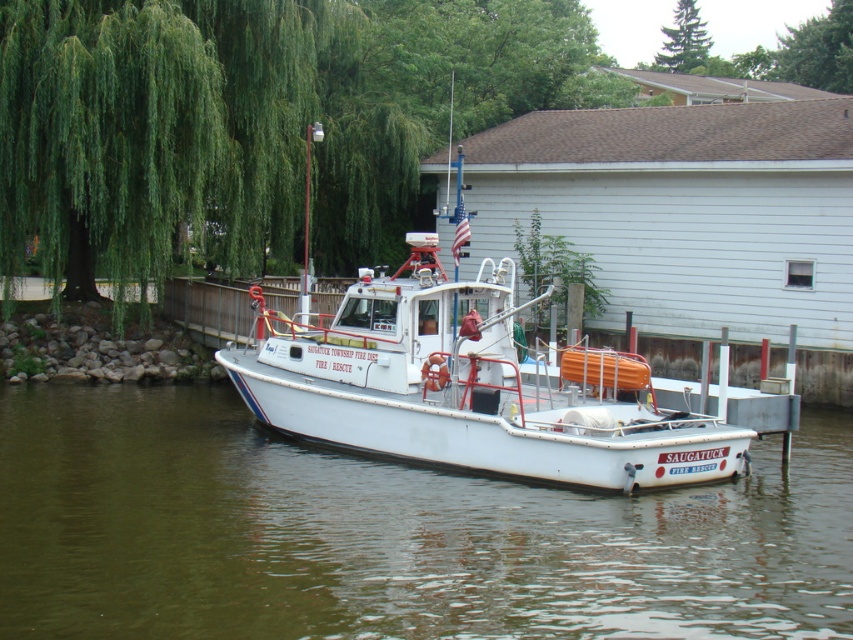
Does white matte boat at center appear on the right side of green leafy tree at upper center?

In fact, white matte boat at center is to the left of green leafy tree at upper center.

Who is more distant from viewer, (488, 282) or (688, 26)?

The point (688, 26) is behind.

Image resolution: width=853 pixels, height=640 pixels. Describe the element at coordinates (467, 387) in the screenshot. I see `white matte boat at center` at that location.

Find the location of a particular element. white matte boat at center is located at coordinates (467, 387).

Which is below, white smooth water at center or green leafy tree at upper center?

white smooth water at center is below.

Which is above, white smooth water at center or green leafy tree at upper center?

Positioned higher is green leafy tree at upper center.

Identify the location of white smooth water at center. This screenshot has width=853, height=640. (387, 534).

Is white smooth water at center wider than white matte boat at center?

Indeed, white smooth water at center has a greater width compared to white matte boat at center.

Can you confirm if white smooth water at center is thinner than white matte boat at center?

No, white smooth water at center is not thinner than white matte boat at center.

The image size is (853, 640). What do you see at coordinates (387, 534) in the screenshot?
I see `white smooth water at center` at bounding box center [387, 534].

Image resolution: width=853 pixels, height=640 pixels. Identify the location of white smooth water at center. (387, 534).